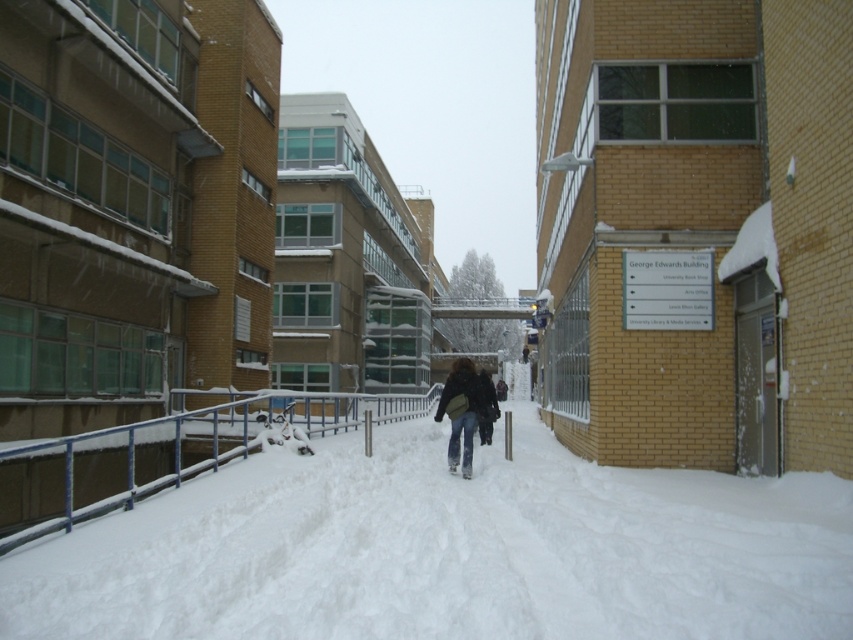
Who is higher up, blue painted metal railing at lower center or denim jacket at center?

Positioned higher is denim jacket at center.

Between blue painted metal railing at lower center and denim jacket at center, which one has less height?

With less height is denim jacket at center.

The width and height of the screenshot is (853, 640). Find the location of `blue painted metal railing at lower center`. blue painted metal railing at lower center is located at coordinates (212, 445).

Between white powdery snow at center and denim jacket at center, which one appears on the right side from the viewer's perspective?

denim jacket at center

Does point (370, 560) lie behind point (466, 410)?

No, (370, 560) is in front of (466, 410).

Does point (148, 500) come behind point (466, 364)?

No.

Find the location of a particular element. The image size is (853, 640). white powdery snow at center is located at coordinates (447, 548).

Between point (532, 465) and point (80, 518), which one is positioned behind?

Point (532, 465)

Identify the location of white powdery snow at center. Image resolution: width=853 pixels, height=640 pixels. (447, 548).

Identify the location of white powdery snow at center. (447, 548).